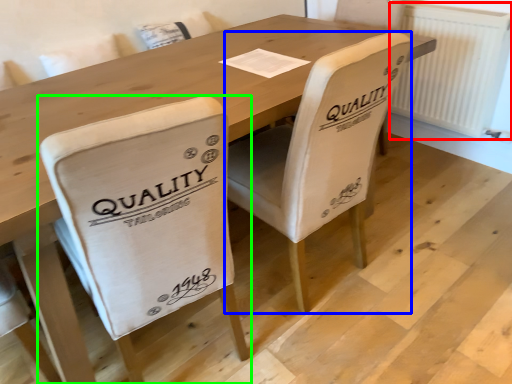
Question: Based on their relative distances, which object is farther from radiator (highlighted by a red box)? Choose from chair (highlighted by a blue box) and chair (highlighted by a green box).

Choices:
 (A) chair
 (B) chair

Answer: (B)